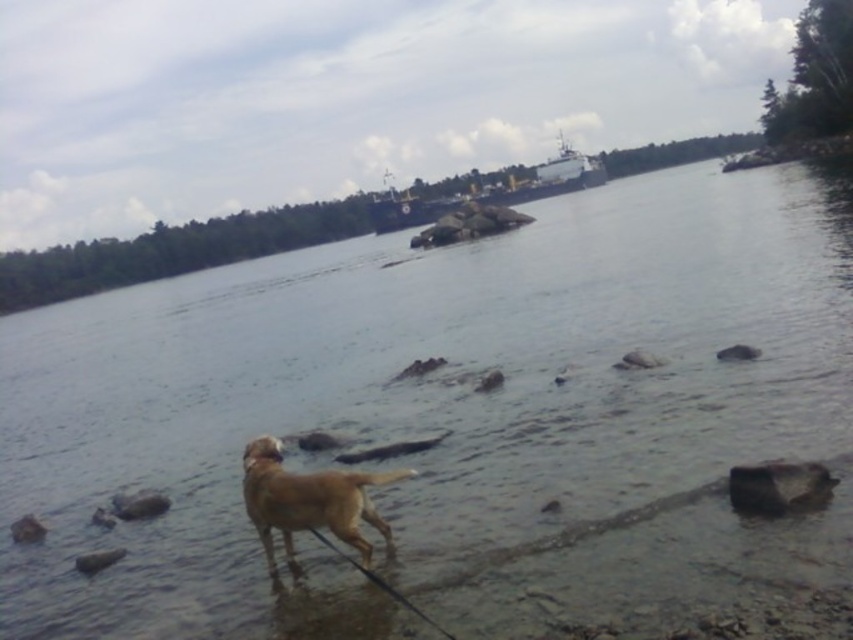
Can you confirm if gray smooth rock at lower right is bigger than gray rock at lower left?

Yes.

Is gray smooth rock at lower right to the left of gray rock at lower left from the viewer's perspective?

In fact, gray smooth rock at lower right is to the right of gray rock at lower left.

The image size is (853, 640). In order to click on gray smooth rock at lower right in this screenshot , I will do `click(778, 484)`.

Where is `gray smooth rock at lower right`? gray smooth rock at lower right is located at coordinates (778, 484).

Who is lower down, golden fur dog at lower center or gray smooth rock at lower right?

golden fur dog at lower center

Measure the distance between golden fur dog at lower center and gray smooth rock at lower right.

They are 8.26 feet apart.

Who is more distant from viewer, (387, 531) or (802, 477)?

Point (387, 531)

Where is `golden fur dog at lower center`? golden fur dog at lower center is located at coordinates (308, 499).

Is metallic gray ship at center above gray smooth rock at lower right?

Indeed, metallic gray ship at center is positioned over gray smooth rock at lower right.

Is point (492, 188) positioned in front of point (795, 488)?

No, it is behind (795, 488).

This screenshot has height=640, width=853. I want to click on metallic gray ship at center, so click(488, 189).

Image resolution: width=853 pixels, height=640 pixels. I want to click on metallic gray ship at center, so click(488, 189).